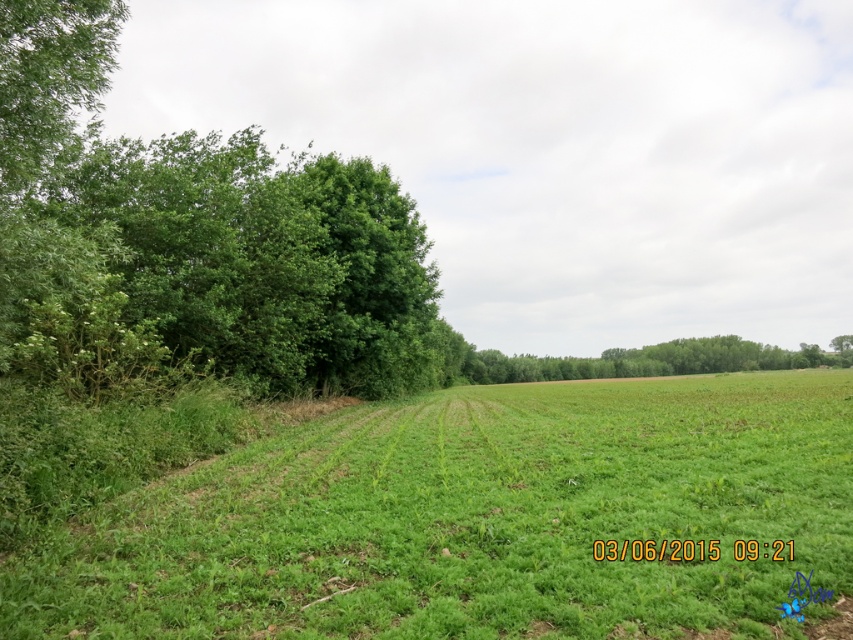
Question: Observing the image, what is the correct spatial positioning of green grassy field at lower left in reference to green leafy tree at left?

Choices:
 (A) above
 (B) below

Answer: (B)

Question: Which object is the farthest from the green leafy tree at left?

Choices:
 (A) green leafy tree at center
 (B) green grassy field at lower left

Answer: (A)

Question: Considering the real-world distances, which object is farthest from the green leafy tree at left?

Choices:
 (A) green grassy field at lower left
 (B) green leafy tree at center

Answer: (B)

Question: Observing the image, what is the correct spatial positioning of green leafy tree at left in reference to green leafy tree at center?

Choices:
 (A) left
 (B) right

Answer: (A)

Question: Does green grassy field at lower left come behind green leafy tree at left?

Choices:
 (A) no
 (B) yes

Answer: (A)

Question: Among these objects, which one is nearest to the camera?

Choices:
 (A) green leafy tree at left
 (B) green leafy tree at center

Answer: (A)